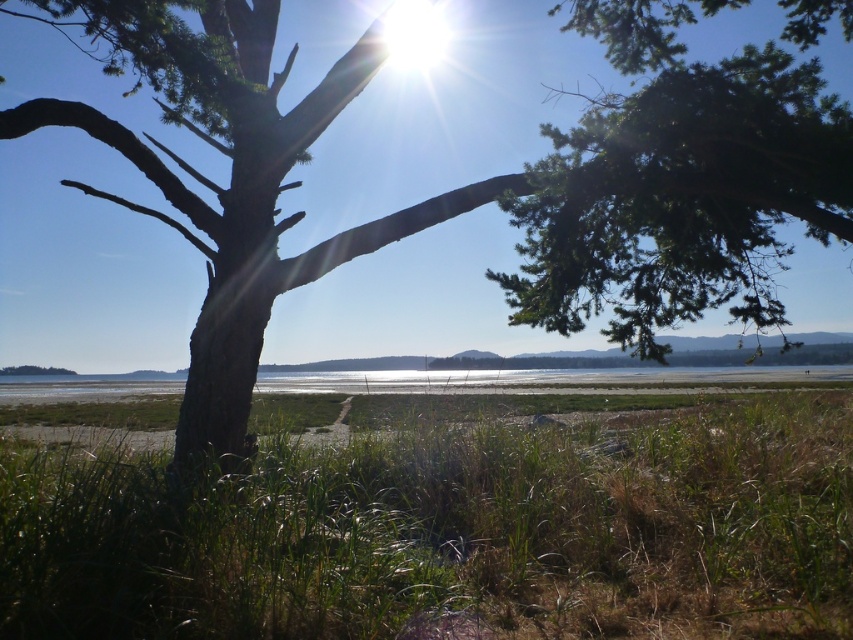
Question: Is green grassy at lower center closer to camera compared to green needle-like foliage at upper center?

Choices:
 (A) no
 (B) yes

Answer: (B)

Question: Among these points, which one is nearest to the camera?

Choices:
 (A) (247, 580)
 (B) (602, 104)

Answer: (A)

Question: Can you confirm if green grassy at lower center is wider than green needle-like foliage at upper center?

Choices:
 (A) no
 (B) yes

Answer: (A)

Question: From the image, what is the correct spatial relationship of green grassy at lower center in relation to green needle-like foliage at upper center?

Choices:
 (A) above
 (B) below

Answer: (B)